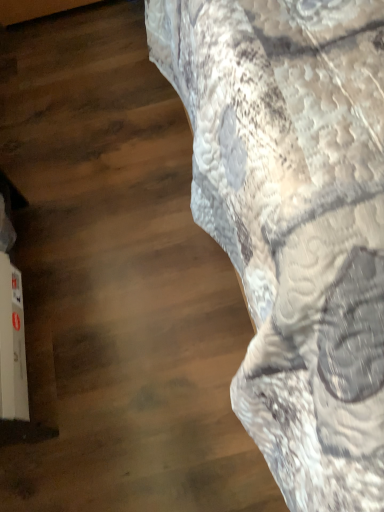
The width and height of the screenshot is (384, 512). What do you see at coordinates (294, 221) in the screenshot?
I see `textured fabric bedspread at upper right` at bounding box center [294, 221].

Identify the location of textured fabric bedspread at upper right. This screenshot has width=384, height=512. (294, 221).

I want to click on textured fabric bedspread at upper right, so click(x=294, y=221).